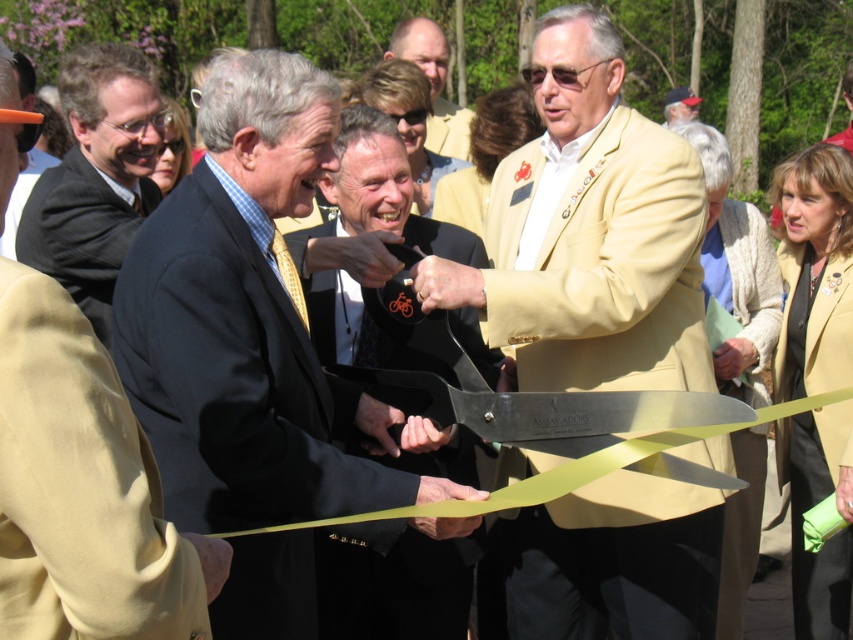
Is point (106, 429) closer to camera compared to point (422, 20)?

Yes, point (106, 429) is in front of point (422, 20).

Who is more distant from viewer, (45, 524) or (396, 38)?

Positioned behind is point (396, 38).

Image resolution: width=853 pixels, height=640 pixels. What are the coordinates of `matte black suit at left` in the screenshot? It's located at (82, 490).

Which is above, matte gold suit at center or light brown leather jacket at upper center?

light brown leather jacket at upper center

Identify the location of matte gold suit at center. The width and height of the screenshot is (853, 640). (589, 232).

In the scene shown: Does matte black suit at center have a larger size compared to matte black suit at left?

Yes, matte black suit at center is bigger than matte black suit at left.

Who is shorter, matte black suit at center or matte black suit at left?

matte black suit at left is shorter.

Is point (285, 161) closer to viewer compared to point (13, 499)?

No, (285, 161) is behind (13, 499).

Find the location of a particular element. matte black suit at center is located at coordinates (248, 323).